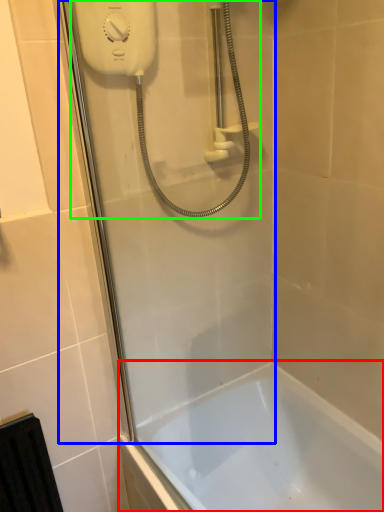
Question: Which object is the farthest from bathtub (highlighted by a red box)? Choose among these: shower door (highlighted by a blue box) or shower (highlighted by a green box).

Choices:
 (A) shower door
 (B) shower

Answer: (B)